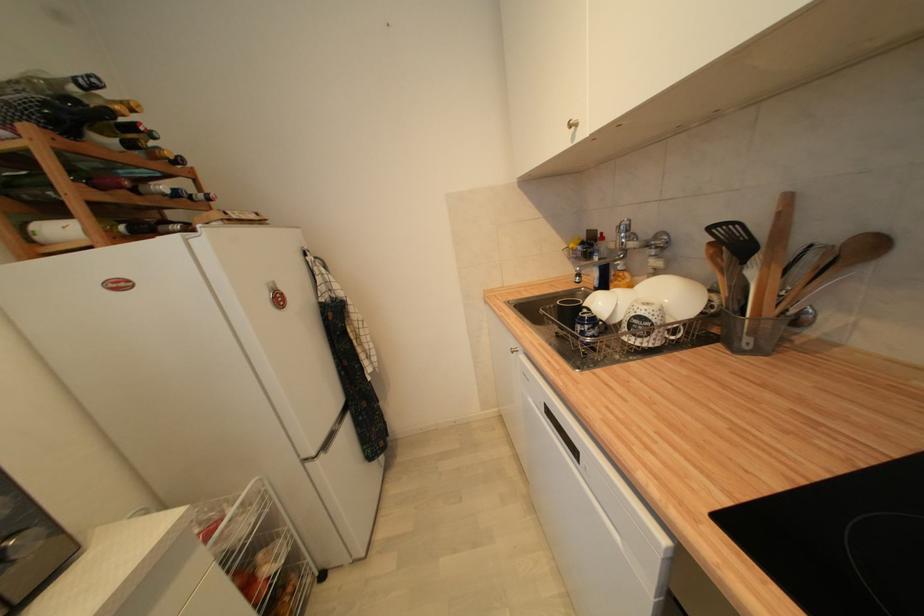
Where would you lift the metal whisk? Please return your answer as a coordinate pair (x, y).

(839, 265)